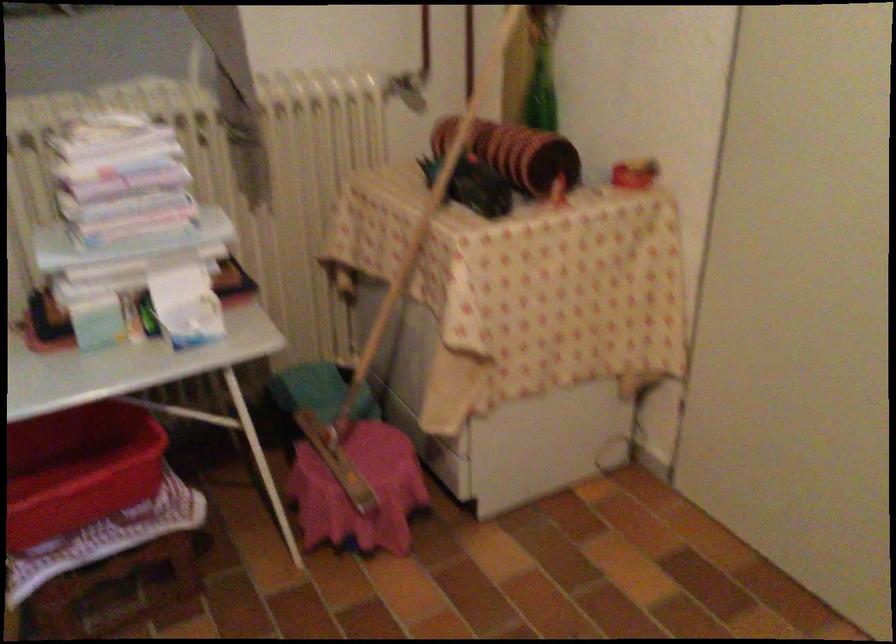
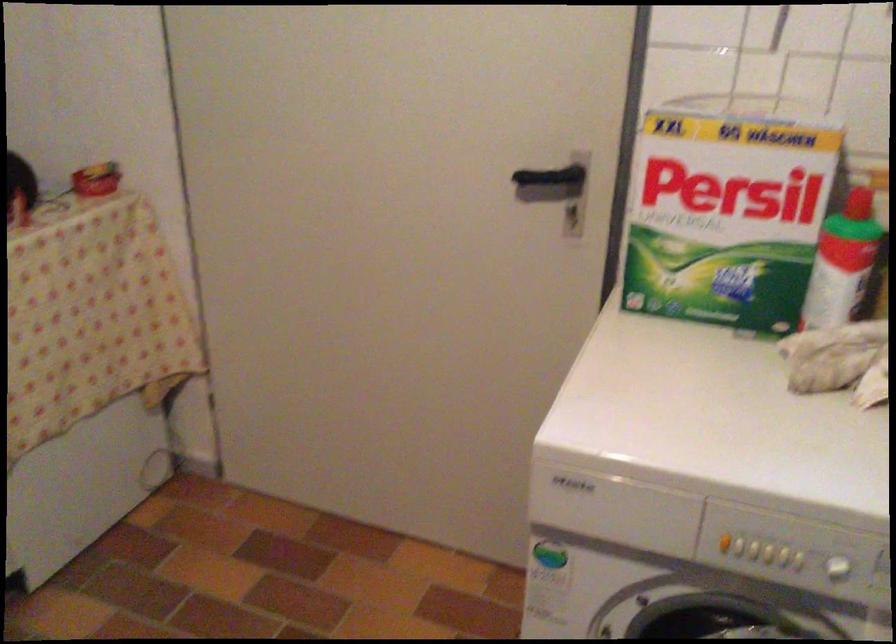
Question: The camera is either moving clockwise (left) or counter-clockwise (right) around the object. The first image is from the beginning of the video and the second image is from the end. Is the camera moving left or right when shooting the video?

Choices:
 (A) Left
 (B) Right

Answer: (A)